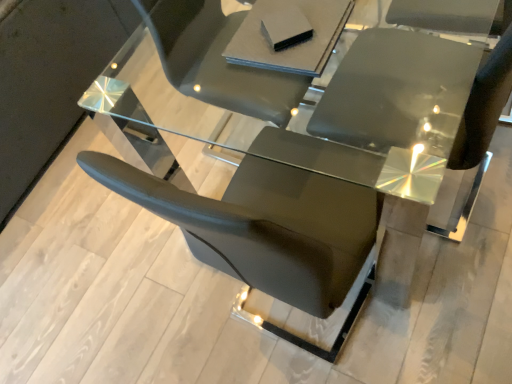
What is the approximate width of matte gray book at upper center, placed as the 1th table when sorted from back to front?

matte gray book at upper center, placed as the 1th table when sorted from back to front, is 10.68 inches wide.

The height and width of the screenshot is (384, 512). What do you see at coordinates (294, 45) in the screenshot?
I see `matte gray book at upper center, the 1th table in the bottom-to-top sequence` at bounding box center [294, 45].

The height and width of the screenshot is (384, 512). In order to click on matte gray book at upper center, the 1th table in the bottom-to-top sequence in this screenshot , I will do `click(294, 45)`.

Between matte gray book at upper center, positioned as the 2th table in top-to-bottom order, and glossy black chair at center, which one appears on the left side from the viewer's perspective?

matte gray book at upper center, positioned as the 2th table in top-to-bottom order, is more to the left.

From a real-world perspective, between matte gray book at upper center, the 1th table in the bottom-to-top sequence, and glossy black chair at center, who is vertically higher?

matte gray book at upper center, the 1th table in the bottom-to-top sequence, from a real-world perspective.

Are matte gray book at upper center, positioned as the 2th table in top-to-bottom order, and glossy black chair at center beside each other?

matte gray book at upper center, positioned as the 2th table in top-to-bottom order, and glossy black chair at center are not in contact.

Which is farther, (266, 62) or (367, 48)?

Positioned behind is point (367, 48).

Is matte gray book at upper center, placed as the 1th table when sorted from back to front, far away from transparent glass table at center, arranged as the first table when viewed from the front?

No.

Which of these two, matte gray book at upper center, positioned as the 2th table in top-to-bottom order, or transparent glass table at center, positioned as the second table in bottom-to-top order, is bigger?

With larger size is transparent glass table at center, positioned as the second table in bottom-to-top order.

From a real-world perspective, is matte gray book at upper center, which is the second table from front to back, beneath transparent glass table at center, which is the 2th table in back-to-front order?

No, from a real-world perspective, matte gray book at upper center, which is the second table from front to back, is not under transparent glass table at center, which is the 2th table in back-to-front order.

Considering the positions of points (240, 36) and (193, 38), is point (240, 36) farther from camera compared to point (193, 38)?

No, it is not.

Looking at this image, from the image's perspective, is transparent glass table at center, arranged as the first table when viewed from the front, located above glossy black chair at center?

Indeed, from the image's perspective, transparent glass table at center, arranged as the first table when viewed from the front, is shown above glossy black chair at center.

Is the depth of transparent glass table at center, arranged as the first table when viewed from the front, greater than that of glossy black chair at center?

Yes, transparent glass table at center, arranged as the first table when viewed from the front, is further from the camera.

Looking at the image, does transparent glass table at center, arranged as the 1th table when viewed from the top, seem bigger or smaller compared to glossy black chair at center?

Considering their sizes, transparent glass table at center, arranged as the 1th table when viewed from the top, takes up more space than glossy black chair at center.

Between transparent glass table at center, arranged as the 1th table when viewed from the top, and matte gray book at upper center, positioned as the 2th table in top-to-bottom order, which one has less height?

Standing shorter between the two is matte gray book at upper center, positioned as the 2th table in top-to-bottom order.

The height and width of the screenshot is (384, 512). What are the coordinates of `table in front of the matte gray book at upper center, placed as the 1th table when sorted from back to front` in the screenshot? It's located at (355, 101).

Between point (197, 77) and point (322, 2), which one is positioned in front?

Point (322, 2)

Is transparent glass table at center, positioned as the second table in bottom-to-top order, bigger than matte gray book at upper center, which is the second table from front to back?

Yes.

Can you confirm if glossy black chair at center is positioned to the left of transparent glass table at center, which is the 2th table in back-to-front order?

In fact, glossy black chair at center is to the right of transparent glass table at center, which is the 2th table in back-to-front order.

Is glossy black chair at center in front of or behind transparent glass table at center, arranged as the 1th table when viewed from the top, in the image?

glossy black chair at center is positioned closer to the viewer than transparent glass table at center, arranged as the 1th table when viewed from the top.

Is glossy black chair at center looking in the opposite direction of transparent glass table at center, arranged as the first table when viewed from the front?

Yes, glossy black chair at center is positioned with its back facing transparent glass table at center, arranged as the first table when viewed from the front.

Consider the image. Measure the distance between glossy black chair at center and transparent glass table at center, positioned as the second table in bottom-to-top order.

They are 3.26 inches apart.

Is glossy black chair at center not inside matte gray book at upper center, positioned as the 2th table in top-to-bottom order?

Absolutely, glossy black chair at center is external to matte gray book at upper center, positioned as the 2th table in top-to-bottom order.

Between glossy black chair at center and matte gray book at upper center, placed as the 1th table when sorted from back to front, which one has less height?

matte gray book at upper center, placed as the 1th table when sorted from back to front.

Is glossy black chair at center looking in the opposite direction of matte gray book at upper center, which is the second table from front to back?

No, glossy black chair at center is not facing away from matte gray book at upper center, which is the second table from front to back.

Which of these two, glossy black chair at center or matte gray book at upper center, which is the second table from front to back, is smaller?

matte gray book at upper center, which is the second table from front to back, is smaller.

At what (x,y) coordinates should I click in order to perform the action: click on the 2nd table counting from the left of the glossy black chair at center. Please return your answer as a coordinate pair (x, y). Looking at the image, I should click on (294, 45).

The width and height of the screenshot is (512, 384). In the image, there is a matte gray book at upper center, which is the second table from front to back. Find the location of `table below it (from a real-world perspective)`. table below it (from a real-world perspective) is located at coordinates [x=355, y=101].

From the image, which object appears to be nearer to transparent glass table at center, arranged as the 1th table when viewed from the top, matte gray book at upper center, which is the second table from front to back, or glossy black chair at center?

Among the two, glossy black chair at center is located nearer to transparent glass table at center, arranged as the 1th table when viewed from the top.

When comparing their distances from matte gray book at upper center, the 1th table in the bottom-to-top sequence, does glossy black chair at center or transparent glass table at center, arranged as the first table when viewed from the front, seem closer?

transparent glass table at center, arranged as the first table when viewed from the front, is positioned closer to the anchor matte gray book at upper center, the 1th table in the bottom-to-top sequence.

Based on the photo, based on their spatial positions, is glossy black chair at center or matte gray book at upper center, the 1th table in the bottom-to-top sequence, further from transparent glass table at center, arranged as the 1th table when viewed from the top?

The object further to transparent glass table at center, arranged as the 1th table when viewed from the top, is matte gray book at upper center, the 1th table in the bottom-to-top sequence.

From the image, which object appears to be nearer to glossy black chair at center, matte gray book at upper center, which is the second table from front to back, or transparent glass table at center, arranged as the 1th table when viewed from the top?

transparent glass table at center, arranged as the 1th table when viewed from the top, is positioned closer to the anchor glossy black chair at center.

Considering their positions, is transparent glass table at center, arranged as the 1th table when viewed from the top, positioned closer to matte gray book at upper center, the 1th table in the bottom-to-top sequence, than glossy black chair at center?

transparent glass table at center, arranged as the 1th table when viewed from the top.

From the image, which object appears to be nearer to glossy black chair at center, transparent glass table at center, positioned as the second table in bottom-to-top order, or matte gray book at upper center, the 1th table in the bottom-to-top sequence?

Among the two, transparent glass table at center, positioned as the second table in bottom-to-top order, is located nearer to glossy black chair at center.

You are a GUI agent. You are given a task and a screenshot of the screen. Output one action in this format:
    pyautogui.click(x=<x>, y=<y>)
    Task: Click on the table located between matte gray book at upper center, positioned as the 2th table in top-to-bottom order, and glossy black chair at center in the left-right direction
    This screenshot has height=384, width=512.
    Given the screenshot: What is the action you would take?
    pyautogui.click(x=355, y=101)